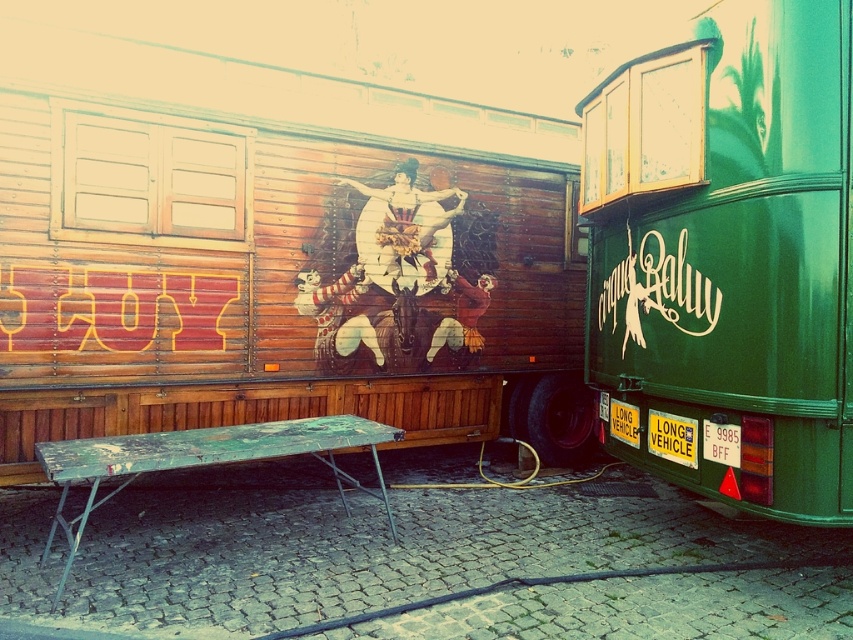
Question: Does green glossy trailer at right appear over rusty metal picnic table at center?

Choices:
 (A) yes
 (B) no

Answer: (A)

Question: Can you confirm if wooden table at lower left is positioned above white plastic sign at center?

Choices:
 (A) no
 (B) yes

Answer: (B)

Question: Which point is closer to the camera taking this photo?

Choices:
 (A) (213, 429)
 (B) (717, 428)
 (C) (631, 422)

Answer: (B)

Question: Does rusty metal picnic table at center appear on the left side of white plastic sign at center?

Choices:
 (A) no
 (B) yes

Answer: (B)

Question: Based on their relative distances, which object is farther from the rusty metal picnic table at center?

Choices:
 (A) wooden table at lower left
 (B) white plastic license plate at center

Answer: (B)

Question: Which point appears farthest from the camera in this image?

Choices:
 (A) (746, 468)
 (B) (252, 451)

Answer: (B)